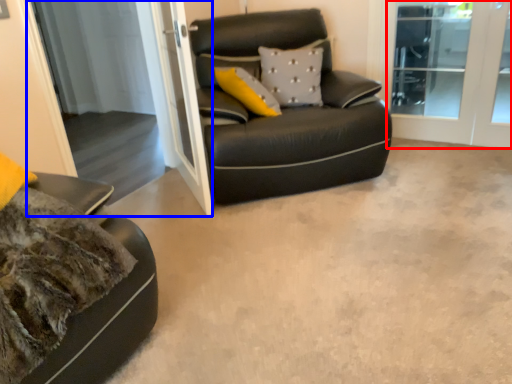
Question: Which object is further to the camera taking this photo, screen door (highlighted by a red box) or screen door (highlighted by a blue box)?

Choices:
 (A) screen door
 (B) screen door

Answer: (A)